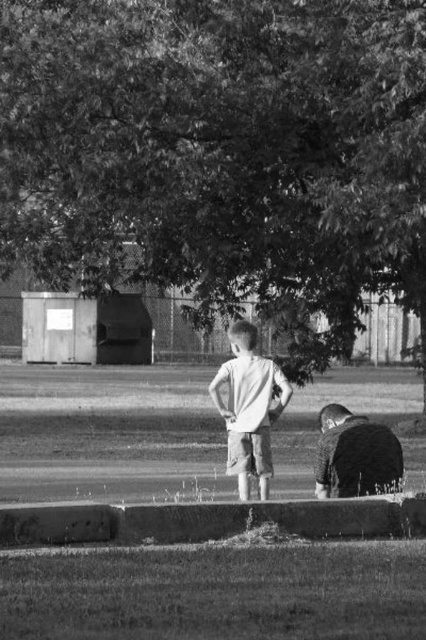
Does point (241, 484) come farther from viewer compared to point (391, 476)?

No, it is in front of (391, 476).

Can you confirm if white matte shirt at center is wider than dark fabric stroller at lower right?

In fact, white matte shirt at center might be narrower than dark fabric stroller at lower right.

Find the location of a particular element. Image resolution: width=426 pixels, height=640 pixels. white matte shirt at center is located at coordinates (249, 408).

Is dark green leafy tree at center behind concrete curb at lower center?

Yes.

Does dark green leafy tree at center come in front of concrete curb at lower center?

No, it is behind concrete curb at lower center.

Which is behind, point (28, 163) or point (268, 513)?

The point (28, 163) is behind.

Find the location of a particular element. This screenshot has width=426, height=640. dark green leafy tree at center is located at coordinates (219, 150).

Measure the distance between concrete curb at lower center and dark fabric stroller at lower right.

concrete curb at lower center is 1.89 meters away from dark fabric stroller at lower right.

Locate an element on the screen. This screenshot has height=640, width=426. concrete curb at lower center is located at coordinates (207, 520).